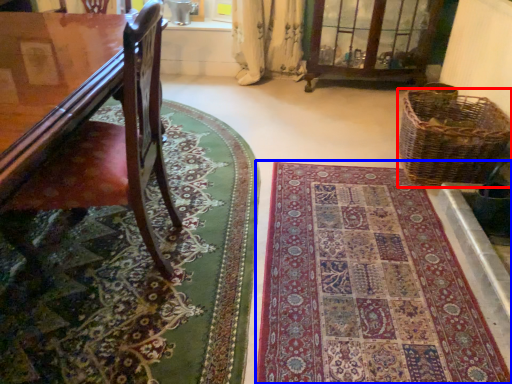
Question: Which object is closer to the camera taking this photo, picnic basket (highlighted by a red box) or mat (highlighted by a blue box)?

Choices:
 (A) picnic basket
 (B) mat

Answer: (B)